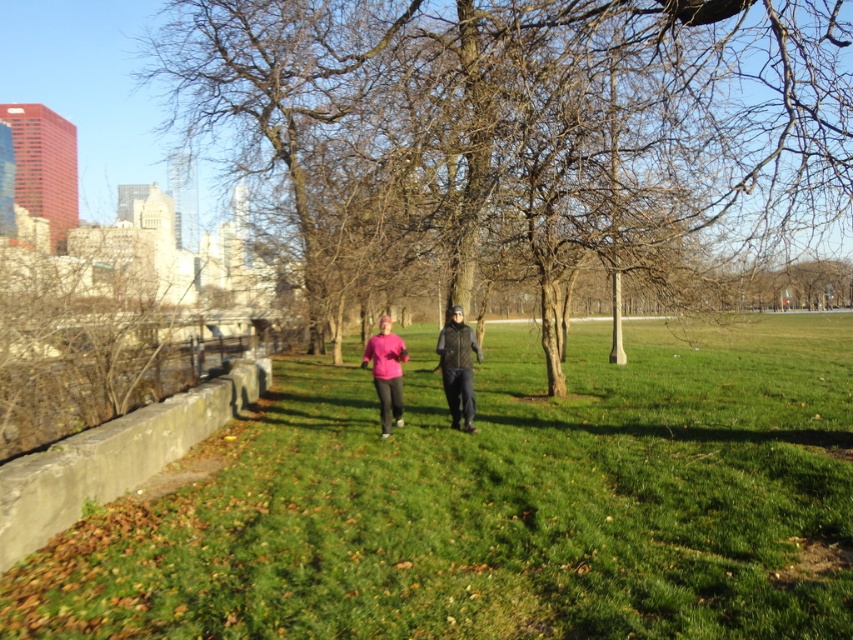
Question: Based on their relative distances, which object is nearer to the brown/dry bark tree at center?

Choices:
 (A) green grassy at center
 (B) pink matte shirt at center

Answer: (A)

Question: Which object appears farthest from the camera in this image?

Choices:
 (A) dark green quilted vest at center
 (B) brown/dry bark tree at center
 (C) green grassy at center

Answer: (A)

Question: Can you confirm if green grassy at center is positioned below dark green quilted vest at center?

Choices:
 (A) no
 (B) yes

Answer: (B)

Question: Based on their relative distances, which object is farther from the green grassy at center?

Choices:
 (A) dark green quilted vest at center
 (B) pink matte shirt at center

Answer: (A)

Question: Does green grassy at center have a larger size compared to brown/dry bark tree at center?

Choices:
 (A) yes
 (B) no

Answer: (B)

Question: Is brown/dry bark tree at center to the right of pink matte shirt at center from the viewer's perspective?

Choices:
 (A) no
 (B) yes

Answer: (B)